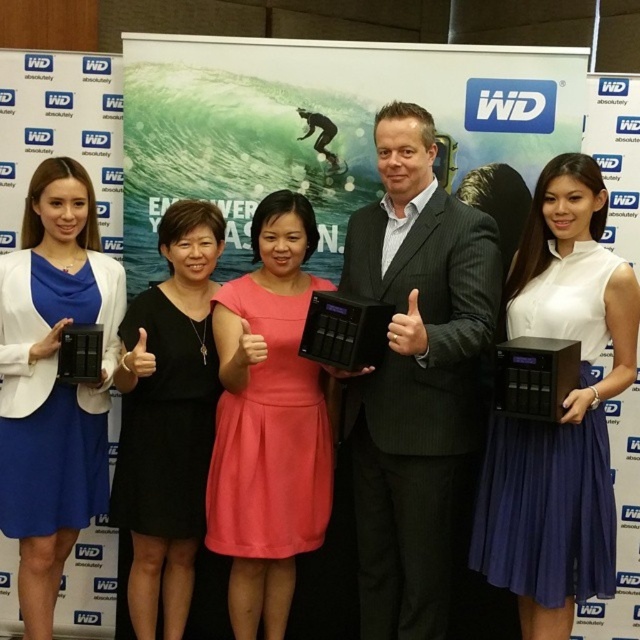
Who is higher up, black pinstripe suit at center or white matte skirt at center?

Positioned higher is black pinstripe suit at center.

Is point (364, 454) less distant than point (515, 577)?

No.

Describe the element at coordinates (416, 378) in the screenshot. I see `black pinstripe suit at center` at that location.

Where is `black pinstripe suit at center`? Image resolution: width=640 pixels, height=640 pixels. black pinstripe suit at center is located at coordinates (416, 378).

Which is behind, point (257, 529) or point (198, 381)?

The point (198, 381) is behind.

Can you confirm if coral satin dress at center is positioned above black matte dress at center?

Indeed, coral satin dress at center is positioned over black matte dress at center.

This screenshot has width=640, height=640. I want to click on coral satin dress at center, so click(269, 420).

Which is behind, point (520, 525) or point (177, 288)?

The point (177, 288) is behind.

Does white matte skirt at center have a greater height compared to black matte dress at center?

Indeed, white matte skirt at center has a greater height compared to black matte dress at center.

Between point (621, 346) and point (202, 502), which one is positioned behind?

The point (202, 502) is behind.

The image size is (640, 640). In order to click on white matte skirt at center in this screenshot , I will do `click(563, 410)`.